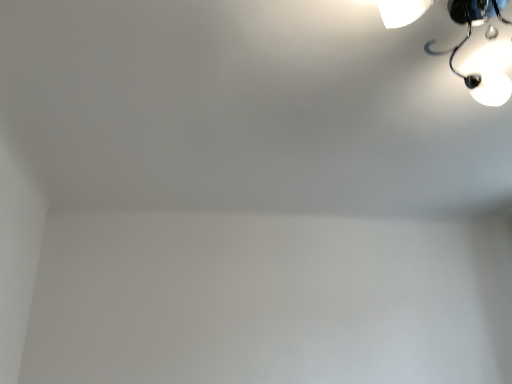
Question: Should I look upward or downward to see white glossy lamp at upper right?

Choices:
 (A) down
 (B) up

Answer: (B)